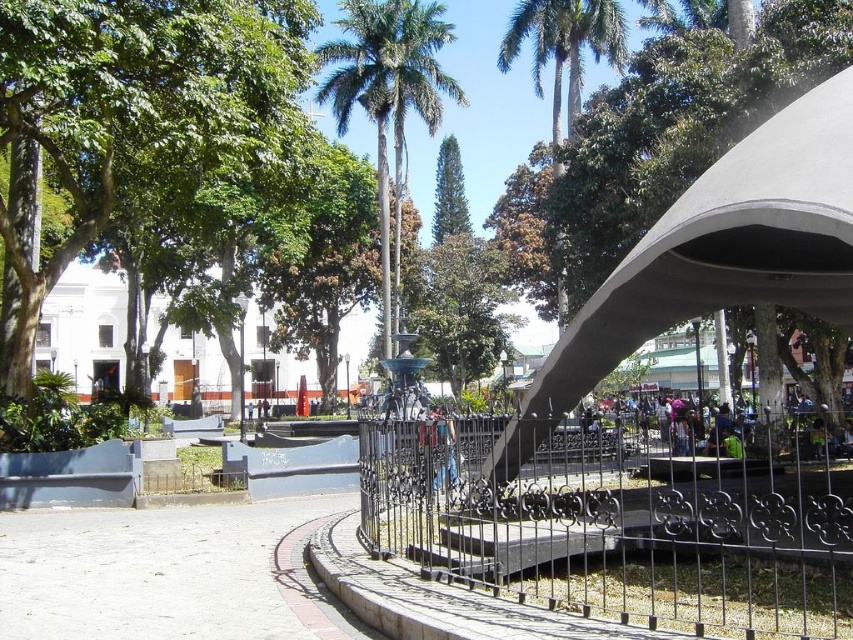
You are a visitor in the public square and want to take a photo of the black wrought iron fence at center without any obstructions. Is the green leafy palm tree at center blocking your view of the fence?

The black wrought iron fence at center is positioned under the green leafy palm tree at center, so the palm tree is blocking the view of the fence.

You are standing in the public square and want to take a photo of the green leafy palm tree at upper center without the black wrought iron fence at center blocking the view. Which direction should you move to ensure the palm tree is visible without the fence?

Move away from the black wrought iron fence at center towards the green leafy palm tree at upper center. Since the black wrought iron fence at center is closer to the viewer, moving away from it will place the fence behind you and allow the palm tree to be visible without obstruction.

You are standing in the public square and want to reach the point marked as point (389, 65). If your walking speed is 1.5 meters per second, how many seconds will it take you to reach that point?

The point (389, 65) is 39.36 meters from camera. At a walking speed of 1.5 meters per second, it will take 39.36 divided by 1.5 equals 26.24 seconds. So approximately 26 seconds.